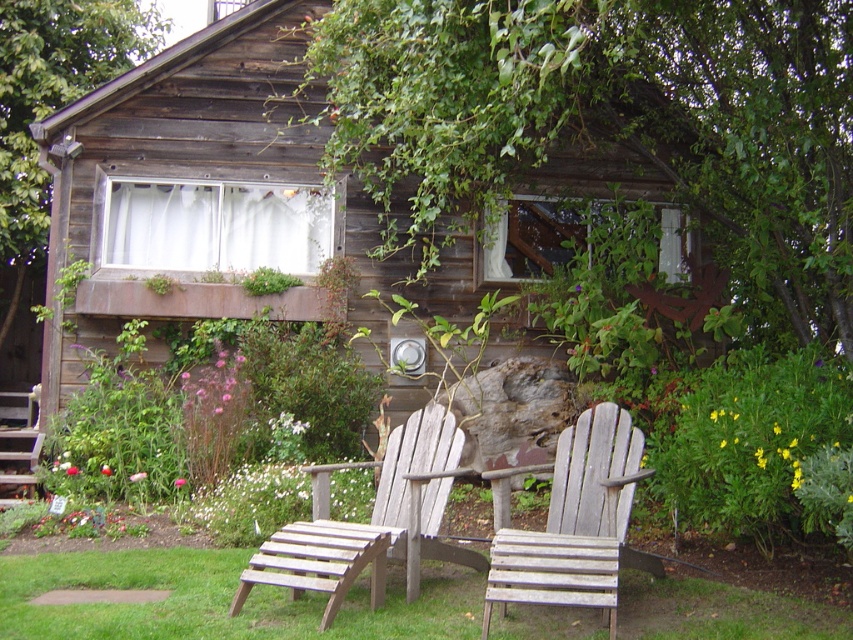
You are standing in front of the wooden cabin and want to place a small potted plant between the two points marked as point (x=631, y=493) and point (x=389, y=531). Which point should you choose to ensure the potted plant is closer to the cabin?

You should place the potted plant at point (x=631, y=493) because it is closer to the viewer, meaning it will be nearer to the cabin compared to point (x=389, y=531) which is further away.

You are sitting in the wooden slats chair at center and want to move to the gray wooden chair at center. Which direction should you move to reach it?

The gray wooden chair at center is to the right of the wooden slats chair at center, so you should move to the right to reach it.

You are sitting in the gray wooden chair at center and want to move to the wooden slats chair at center. Which direction should you move to reach it?

You should move backward to reach the wooden slats chair at center because the gray wooden chair at center is in front of it.